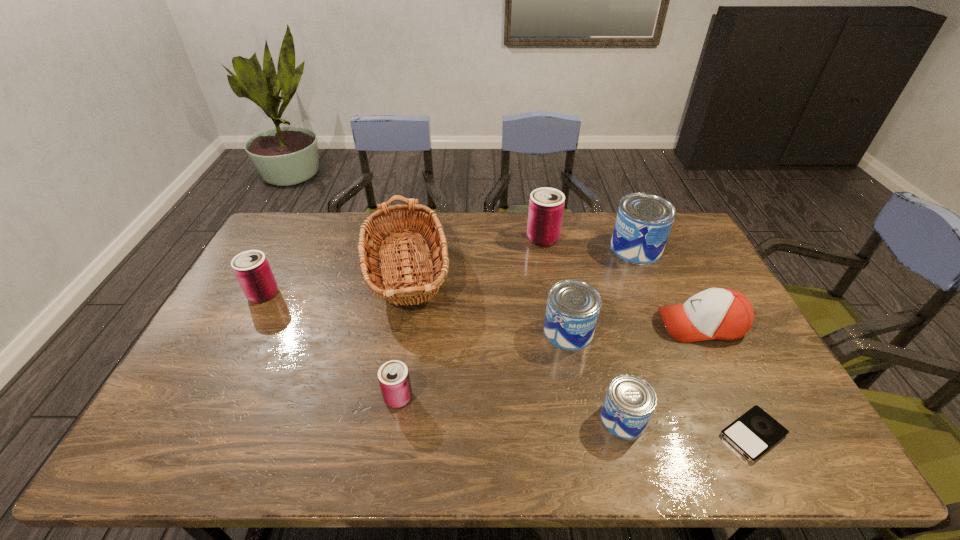
Locate an element on the screen. Image resolution: width=960 pixels, height=540 pixels. the smallest pink can is located at coordinates (393, 376).

The height and width of the screenshot is (540, 960). I want to click on the nearest pink can, so click(x=393, y=376).

The width and height of the screenshot is (960, 540). I want to click on the smallest blue can, so click(630, 401).

At what (x,y) coordinates should I click in order to perform the action: click on gray iPod. Please return your answer as a coordinate pair (x, y). Looking at the image, I should click on (755, 432).

Identify the location of iPod. (755, 432).

The height and width of the screenshot is (540, 960). I want to click on vacant region located on the right of the basket, so click(488, 271).

Find the location of a particular element. The image size is (960, 540). vacant space located 0.270m on the right of the rightmost pink can is located at coordinates (634, 238).

Where is `vacant region located on the front label of the rightmost can`? vacant region located on the front label of the rightmost can is located at coordinates (593, 249).

You are a GUI agent. You are given a task and a screenshot of the screen. Output one action in this format:
    pyautogui.click(x=<x>, y=<y>)
    Task: Click on the vacant position located 0.200m on the front label of the rightmost can
    The width and height of the screenshot is (960, 540).
    Given the screenshot: What is the action you would take?
    pyautogui.click(x=554, y=249)

Find the location of a particular element. vacant space situated on the front label of the rightmost can is located at coordinates (590, 249).